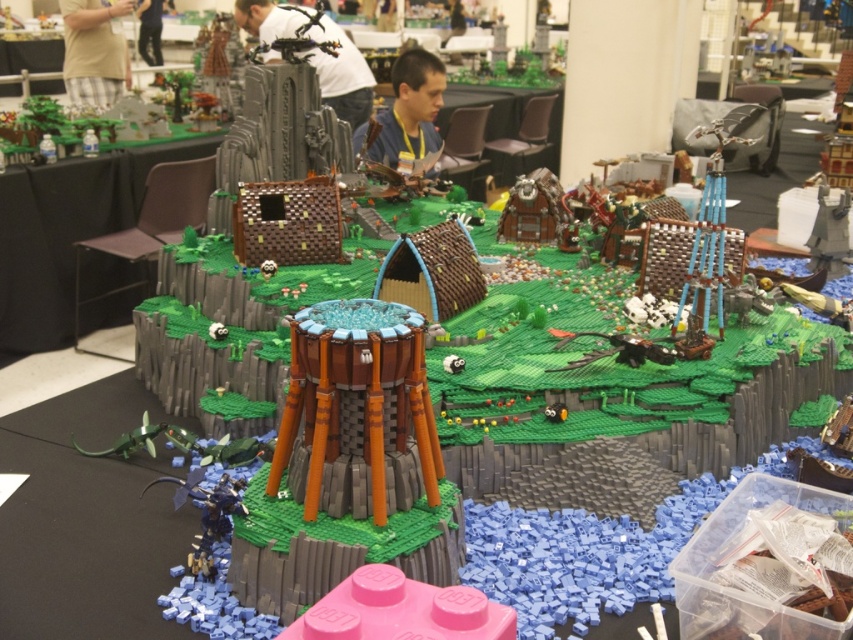
You are a LEGO architect designing a new structure for this diorama. You need to decide where to place a new wide LEGO bridge. Considering the brown textured tower at center and the green grassy hill at upper left, which object has a narrower width to ensure the bridge fits properly?

The brown textured tower at center has a lesser width compared to the green grassy hill at upper left, so the bridge should be placed near the brown textured tower at center to ensure it fits properly.

You are a guest at the LEGO exhibition and notice the brown textured tower at center and the green grassy hill at upper left. Which object is taller in the scene?

The green grassy hill at upper left is taller than the brown textured tower at center.

You are a visitor at the LEGO exhibition and want to take a photo of the brown textured tower at center. The camera you have can focus on objects up to 4 feet away. Will the tower be in focus?

The distance between the brown textured tower at center and the camera is 3.63 feet, which is within the camera focus range of up to 4 feet. Therefore, the tower will be in focus.